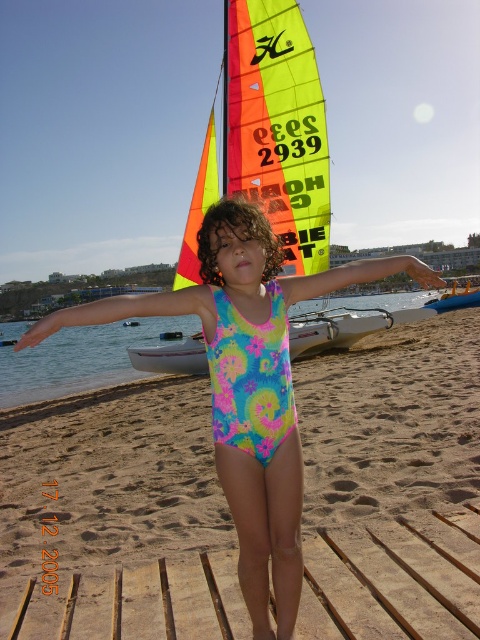
Which of these two, neon floral swimsuit at center or blue plastic boat at center, stands taller?

neon floral swimsuit at center is taller.

Can you confirm if neon floral swimsuit at center is thinner than blue plastic boat at center?

In fact, neon floral swimsuit at center might be wider than blue plastic boat at center.

Which is in front, point (292, 454) or point (458, 307)?

Point (292, 454) is more forward.

Locate an element on the screen. The width and height of the screenshot is (480, 640). neon floral swimsuit at center is located at coordinates (238, 396).

Who is more distant from viewer, [347,339] or [304,276]?

The point [347,339] is behind.

Where is `multicolored fabric sailboat at center`? This screenshot has width=480, height=640. multicolored fabric sailboat at center is located at coordinates (344, 326).

Between point (313, 310) and point (323, 292), which one is positioned in front?

Point (323, 292) is more forward.

The height and width of the screenshot is (640, 480). Find the location of `multicolored fabric sailboat at center`. multicolored fabric sailboat at center is located at coordinates (344, 326).

Can you confirm if neon floral swimsuit at center is positioned below neon fabric arm at center?

Yes, neon floral swimsuit at center is below neon fabric arm at center.

Is point (273, 477) behind point (303, 289)?

That is False.

The height and width of the screenshot is (640, 480). Find the location of `neon floral swimsuit at center`. neon floral swimsuit at center is located at coordinates (238, 396).

I want to click on neon floral swimsuit at center, so click(x=238, y=396).